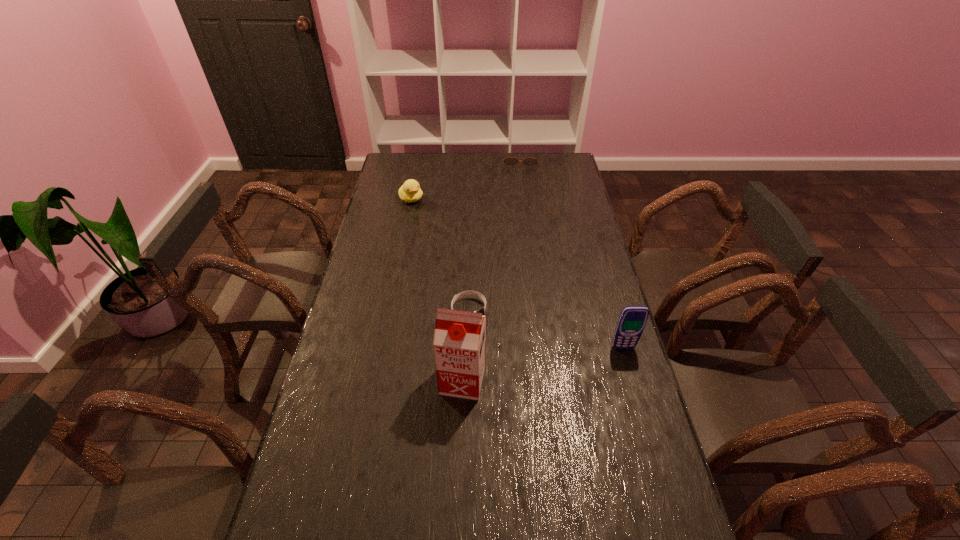
I want to click on the nearest object, so click(x=459, y=339).

In order to click on the tallest object in this screenshot , I will do `click(459, 339)`.

Locate an element on the screen. The height and width of the screenshot is (540, 960). cellular telephone is located at coordinates (632, 320).

You are a GUI agent. You are given a task and a screenshot of the screen. Output one action in this format:
    pyautogui.click(x=<x>, y=<y>)
    Task: Click on the rightmost object
    
    Given the screenshot: What is the action you would take?
    pyautogui.click(x=632, y=320)

Locate an element on the screen. the second farthest object is located at coordinates (410, 191).

Where is `the leftmost object`? The image size is (960, 540). the leftmost object is located at coordinates (410, 191).

Locate an element on the screen. the third farthest object is located at coordinates pyautogui.click(x=470, y=293).

Identify the location of sunglasses. This screenshot has height=540, width=960. (510, 161).

You are a GUI agent. You are given a task and a screenshot of the screen. Output one action in this format:
    pyautogui.click(x=<x>, y=<y>)
    Task: Click on the farthest object
    The image size is (960, 540).
    Given the screenshot: What is the action you would take?
    pyautogui.click(x=510, y=161)

Where is `vacant space positioned on the right of the tallest object`? The height and width of the screenshot is (540, 960). vacant space positioned on the right of the tallest object is located at coordinates (543, 380).